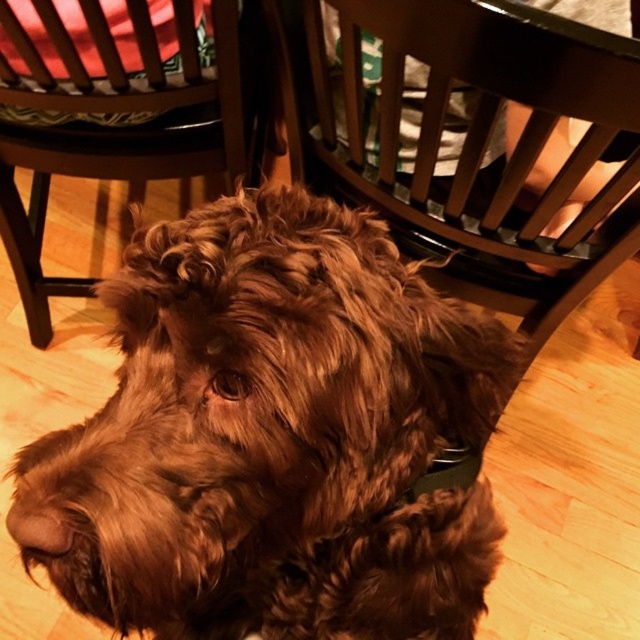
Does point (198, 596) come in front of point (596, 252)?

That is True.

Between brown curly fur dog at center and wooden chair at center, which one has more height?

Standing taller between the two is wooden chair at center.

Does point (189, 586) lie in front of point (376, 88)?

Yes, point (189, 586) is closer to viewer.

Image resolution: width=640 pixels, height=640 pixels. I want to click on brown curly fur dog at center, so click(273, 436).

Does point (465, 52) come farther from viewer compared to point (196, 172)?

No.

Which is behind, point (365, 184) or point (100, 97)?

The point (365, 184) is behind.

Where is `wooden chair at center`? wooden chair at center is located at coordinates (445, 156).

Who is shorter, brown curly fur dog at center or wooden chair at upper left?

brown curly fur dog at center

Which is more to the left, brown curly fur dog at center or wooden chair at upper left?

A: wooden chair at upper left is more to the left.

Is point (403, 268) closer to viewer compared to point (102, 122)?

Yes, point (403, 268) is closer to viewer.

Identify the location of brown curly fur dog at center. The height and width of the screenshot is (640, 640). (273, 436).